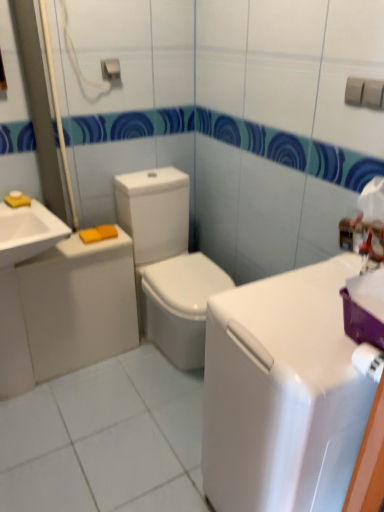
Question: From the image's perspective, would you say metallic silver towel bar at upper center is positioned over white glossy counter top at center?

Choices:
 (A) yes
 (B) no

Answer: (A)

Question: Is the depth of metallic silver towel bar at upper center greater than that of white glossy counter top at center?

Choices:
 (A) no
 (B) yes

Answer: (B)

Question: Is metallic silver towel bar at upper center to the right of white glossy counter top at center from the viewer's perspective?

Choices:
 (A) no
 (B) yes

Answer: (A)

Question: Considering the relative sizes of metallic silver towel bar at upper center and white glossy counter top at center in the image provided, is metallic silver towel bar at upper center shorter than white glossy counter top at center?

Choices:
 (A) no
 (B) yes

Answer: (B)

Question: Is metallic silver towel bar at upper center to the left of white glossy counter top at center from the viewer's perspective?

Choices:
 (A) no
 (B) yes

Answer: (B)

Question: Is white glossy sink at left bigger or smaller than metallic silver towel bar at upper center?

Choices:
 (A) big
 (B) small

Answer: (A)

Question: From their relative heights in the image, would you say white glossy sink at left is taller or shorter than metallic silver towel bar at upper center?

Choices:
 (A) tall
 (B) short

Answer: (A)

Question: Is point (34, 206) closer or farther from the camera than point (112, 59)?

Choices:
 (A) farther
 (B) closer

Answer: (B)

Question: From a real-world perspective, is white glossy sink at left physically located above or below metallic silver towel bar at upper center?

Choices:
 (A) below
 (B) above

Answer: (A)

Question: From the image's perspective, is white glossy counter top at center above or below white glossy sink at left?

Choices:
 (A) above
 (B) below

Answer: (B)

Question: From a real-world perspective, is white glossy counter top at center physically located above or below white glossy sink at left?

Choices:
 (A) above
 (B) below

Answer: (B)

Question: In terms of width, does white glossy counter top at center look wider or thinner when compared to white glossy sink at left?

Choices:
 (A) wide
 (B) thin

Answer: (A)

Question: Would you say white glossy counter top at center is to the left or to the right of white glossy sink at left in the picture?

Choices:
 (A) left
 (B) right

Answer: (B)

Question: Relative to metallic silver towel bar at upper center, is white glossy toilet at center in front or behind?

Choices:
 (A) behind
 (B) front

Answer: (B)

Question: Considering the positions of point (148, 320) and point (100, 65), is point (148, 320) closer or farther from the camera than point (100, 65)?

Choices:
 (A) closer
 (B) farther

Answer: (B)